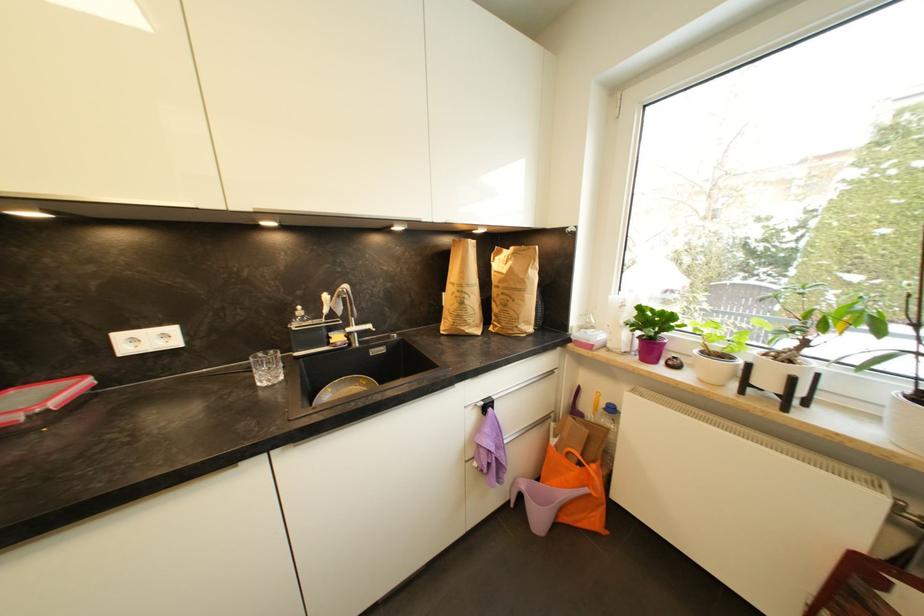
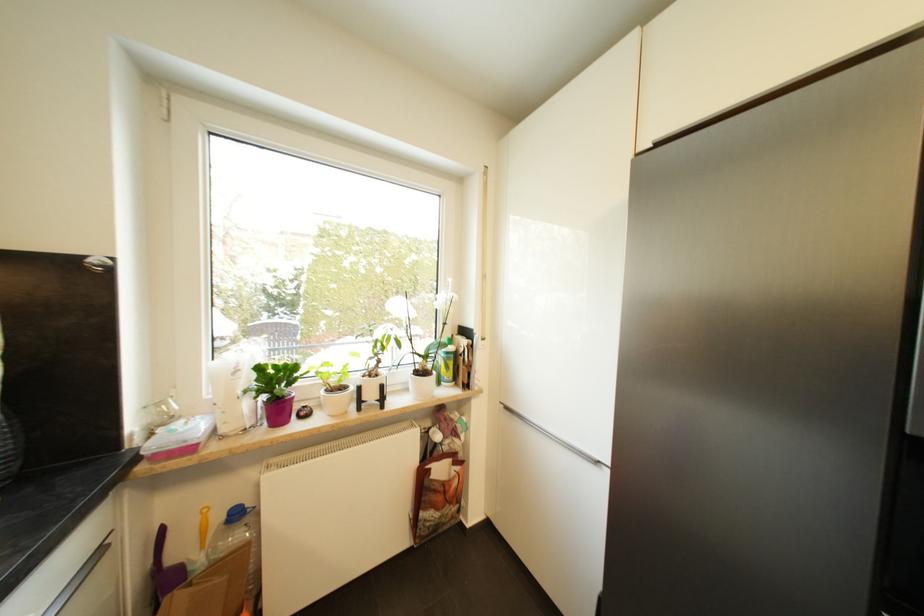
Where in the second image is the point corresponding to (x=601, y=390) from the first image?

(207, 507)